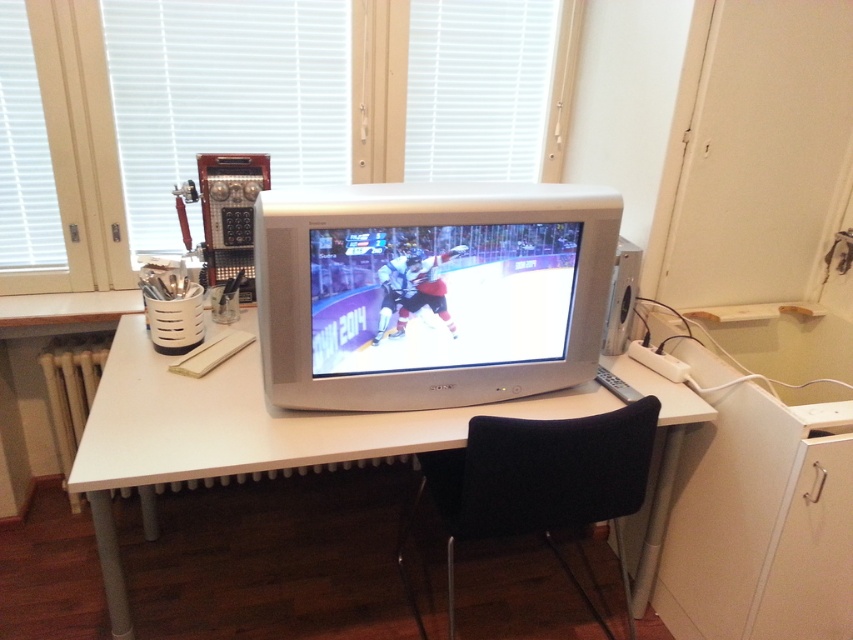
Does matte gray monitor at center lie in front of white glossy computer desk at center?

No, matte gray monitor at center is behind white glossy computer desk at center.

Which is behind, point (544, 381) or point (202, 461)?

Positioned behind is point (544, 381).

The width and height of the screenshot is (853, 640). I want to click on matte gray monitor at center, so click(x=431, y=292).

Locate an element on the screen. matte gray monitor at center is located at coordinates (431, 292).

Between matte gray monitor at center and black fabric chair at center, which one has less height?

matte gray monitor at center is shorter.

How distant is matte gray monitor at center from black fabric chair at center?

The distance of matte gray monitor at center from black fabric chair at center is 14.71 inches.

Does point (415, 204) lie in front of point (450, 483)?

Yes.

Locate an element on the screen. Image resolution: width=853 pixels, height=640 pixels. matte gray monitor at center is located at coordinates (431, 292).

Does white glossy computer desk at center have a lesser width compared to black fabric chair at center?

Incorrect, white glossy computer desk at center's width is not less than black fabric chair at center's.

In the scene shown: Is white glossy computer desk at center to the right of black fabric chair at center from the viewer's perspective?

Incorrect, white glossy computer desk at center is not on the right side of black fabric chair at center.

Between point (235, 374) and point (567, 525), which one is positioned behind?

Point (235, 374)

Identify the location of white glossy computer desk at center. This screenshot has width=853, height=640. (242, 433).